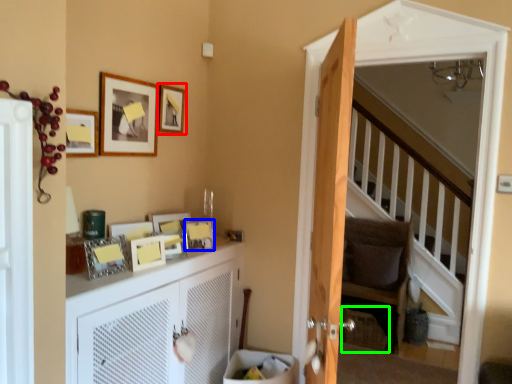
Question: Estimate the real-world distances between objects in this image. Which object is farther from picture frame (highlighted by a red box), picture frame (highlighted by a blue box) or basket (highlighted by a green box)?

Choices:
 (A) picture frame
 (B) basket

Answer: (B)